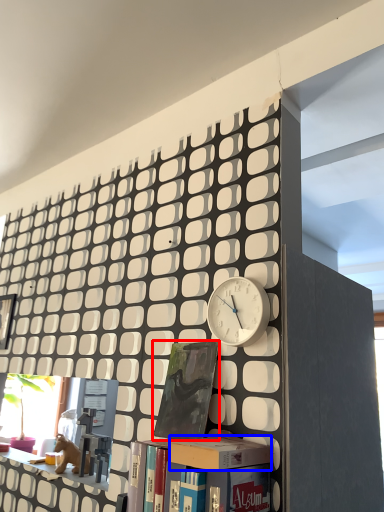
Question: Which object is closer to the camera taking this photo, book (highlighted by a red box) or box (highlighted by a blue box)?

Choices:
 (A) book
 (B) box

Answer: (B)